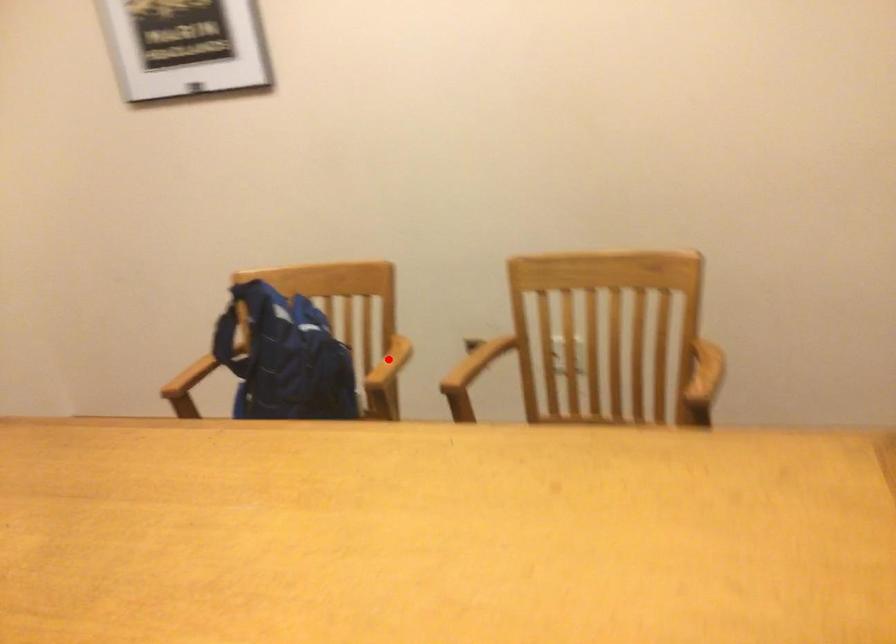
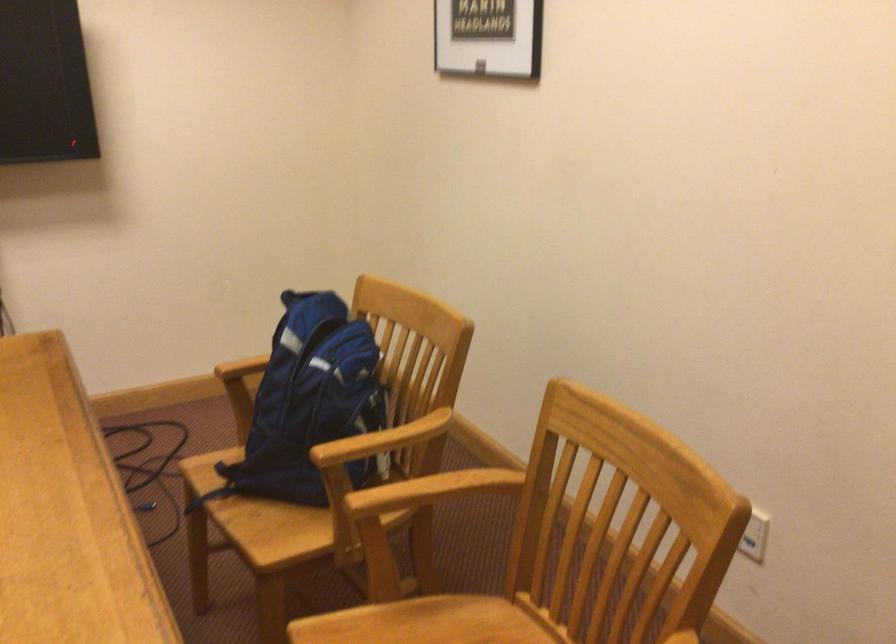
Where in the second image is the point corresponding to the highlighted location from the first image?

(383, 440)